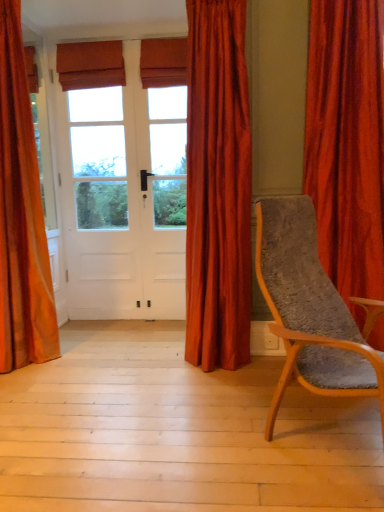
Locate an element on the screen. free spot below wooden textured chair at right (from a real-world perspective) is located at coordinates (326, 426).